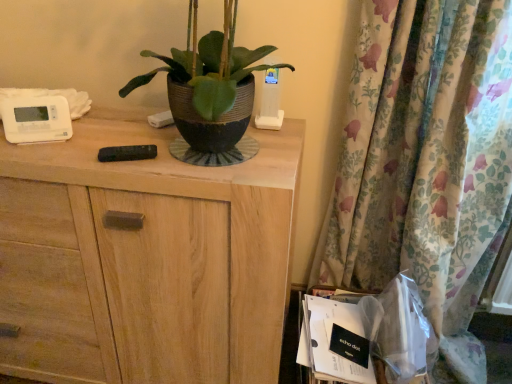
Question: Would you consider white paper at lower right to be distant from floral fabric curtain at right?

Choices:
 (A) yes
 (B) no

Answer: (B)

Question: Is white paper at lower right in front of floral fabric curtain at right?

Choices:
 (A) no
 (B) yes

Answer: (A)

Question: Does white paper at lower right have a greater width compared to floral fabric curtain at right?

Choices:
 (A) yes
 (B) no

Answer: (B)

Question: Does white paper at lower right lie behind floral fabric curtain at right?

Choices:
 (A) no
 (B) yes

Answer: (B)

Question: Could you tell me if white paper at lower right is turned towards floral fabric curtain at right?

Choices:
 (A) yes
 (B) no

Answer: (B)

Question: In terms of size, does white paper at lower right appear bigger or smaller than wooden cabinet at center?

Choices:
 (A) small
 (B) big

Answer: (A)

Question: Does point (317, 360) appear closer or farther from the camera than point (250, 314)?

Choices:
 (A) farther
 (B) closer

Answer: (B)

Question: Is white paper at lower right wider or thinner than wooden cabinet at center?

Choices:
 (A) thin
 (B) wide

Answer: (A)

Question: From the image's perspective, is white paper at lower right located above or below wooden cabinet at center?

Choices:
 (A) above
 (B) below

Answer: (B)

Question: From a real-world perspective, is floral fabric curtain at right physically located above or below transparent plastic bag at lower right?

Choices:
 (A) below
 (B) above

Answer: (B)

Question: Relative to transparent plastic bag at lower right, is floral fabric curtain at right in front or behind?

Choices:
 (A) front
 (B) behind

Answer: (A)

Question: Is point (462, 294) closer or farther from the camera than point (390, 362)?

Choices:
 (A) closer
 (B) farther

Answer: (B)

Question: Considering the relative positions of floral fabric curtain at right and transparent plastic bag at lower right in the image provided, is floral fabric curtain at right to the left or to the right of transparent plastic bag at lower right?

Choices:
 (A) left
 (B) right

Answer: (B)

Question: From a real-world perspective, is transparent plastic bag at lower right physically located above or below wooden cabinet at center?

Choices:
 (A) below
 (B) above

Answer: (B)

Question: Is transparent plastic bag at lower right wider or thinner than wooden cabinet at center?

Choices:
 (A) wide
 (B) thin

Answer: (B)